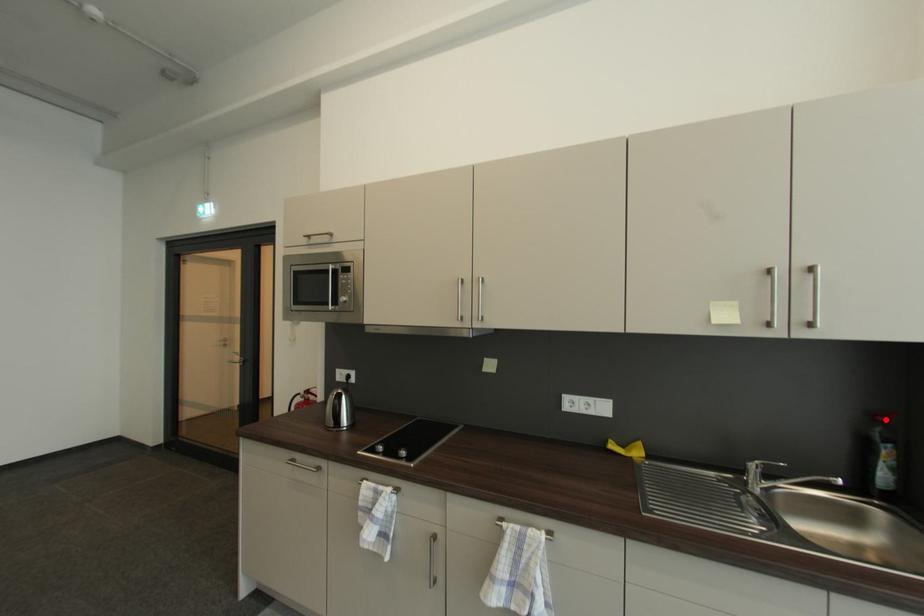
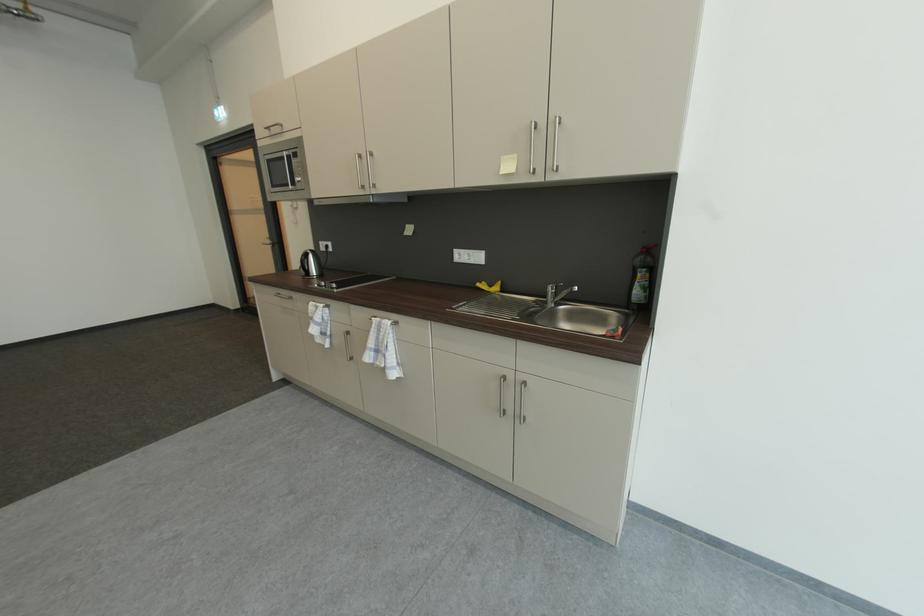
Question: I am providing you with two images of the same scene from different viewpoints. A red point is marked on the first image. Is the red point's position out of view in image 2?

Choices:
 (A) Yes
 (B) No

Answer: (B)